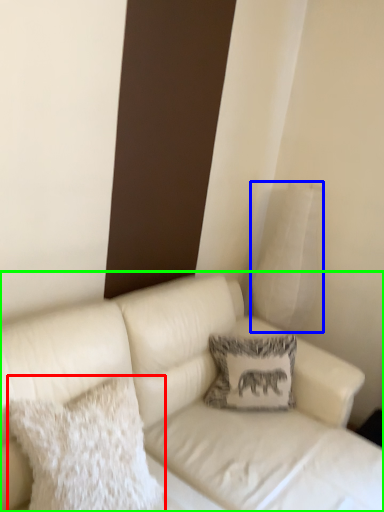
Question: Estimate the real-world distances between objects in this image. Which object is closer to pillow (highlighted by a red box), pillow (highlighted by a blue box) or studio couch (highlighted by a green box)?

Choices:
 (A) pillow
 (B) studio couch

Answer: (B)